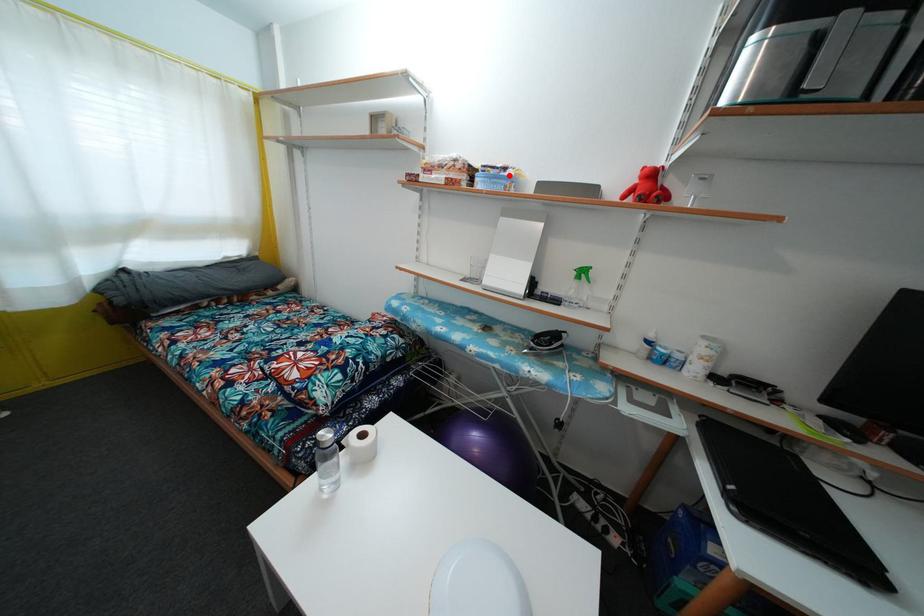
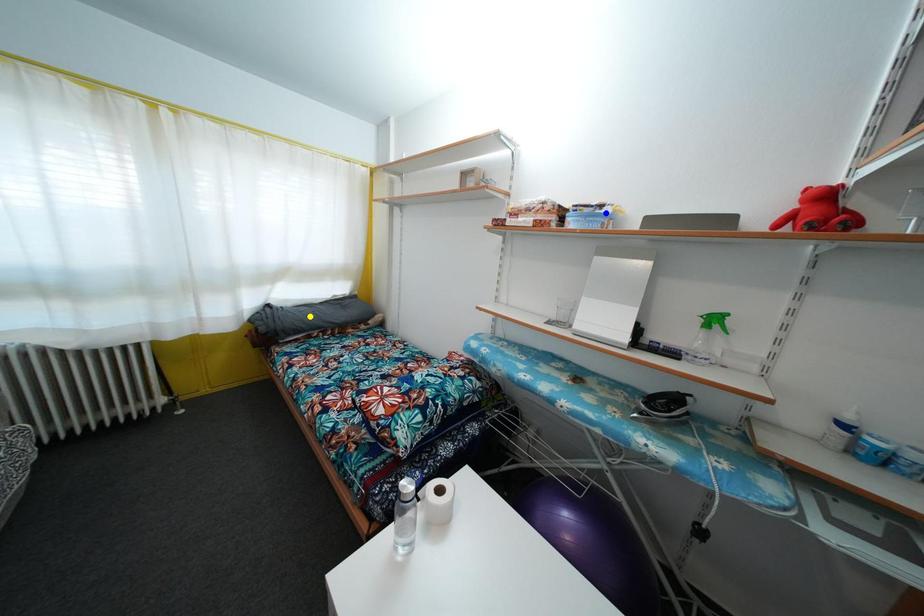
Question: I am providing you with two images of the same scene from different viewpoints. A red point is marked on the first image. You are given multiple points on the second image. Which point in image 2 is actually the same real-world point as the red point in image 1?

Choices:
 (A) yellow point
 (B) green point
 (C) blue point

Answer: (C)